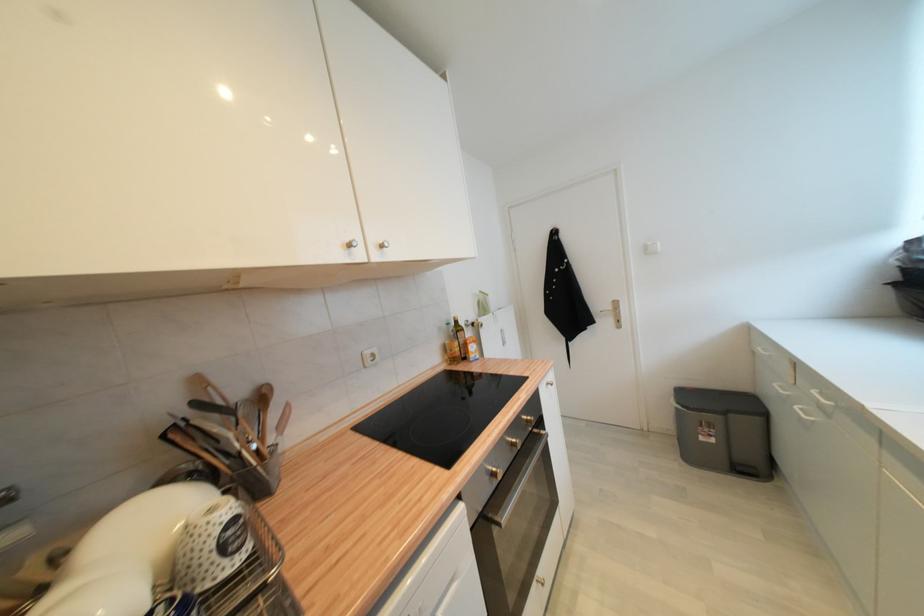
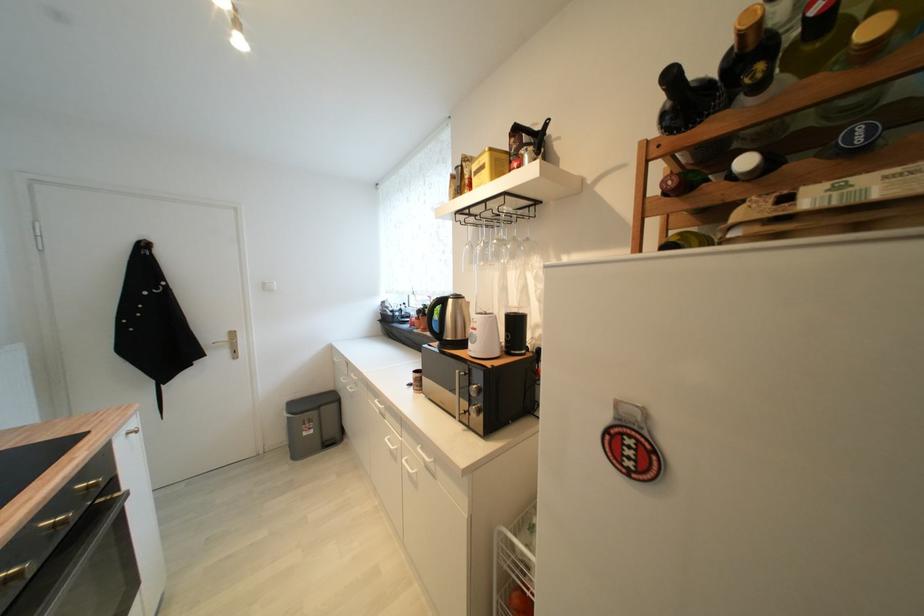
Find the pixel in the second image that matches pixel 614 310 in the first image.

(229, 339)